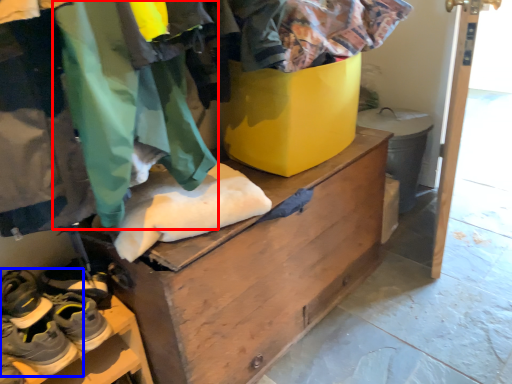
Question: Among these objects, which one is nearest to the camera, clothing (highlighted by a red box) or footwear (highlighted by a blue box)?

Choices:
 (A) clothing
 (B) footwear

Answer: (A)